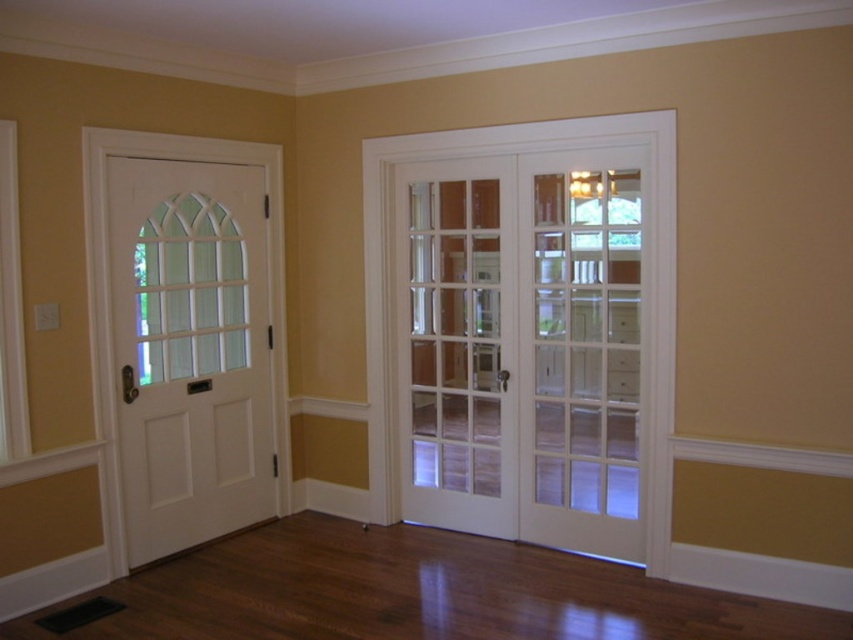
In the scene shown: You are standing in the middle of the room and want to exit through the clear glass doors at center. Which direction should you walk to reach them?

The clear glass doors at center are located at point coordinates, so you should walk towards the direction of the clear glass doors at center based on their position in the room.

You are moving a large painting that is 1.2 meters wide. You need to pass through either the clear glass doors at center or the white glossy door at left. Based on their widths, which door should you choose?

The clear glass doors at center have a larger width than the white glossy door at left, so you should choose the clear glass doors at center to pass through with your large painting.